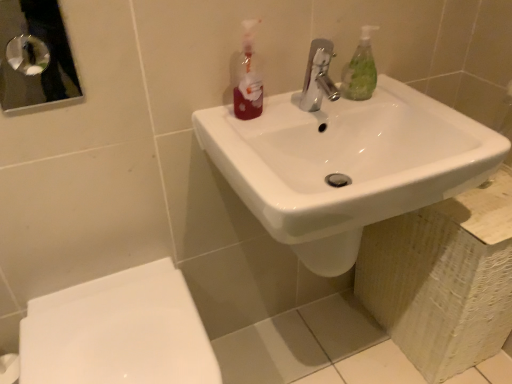
The height and width of the screenshot is (384, 512). Identify the location of vacant space that is to the left of green translucent soap dispenser at upper right. (309, 107).